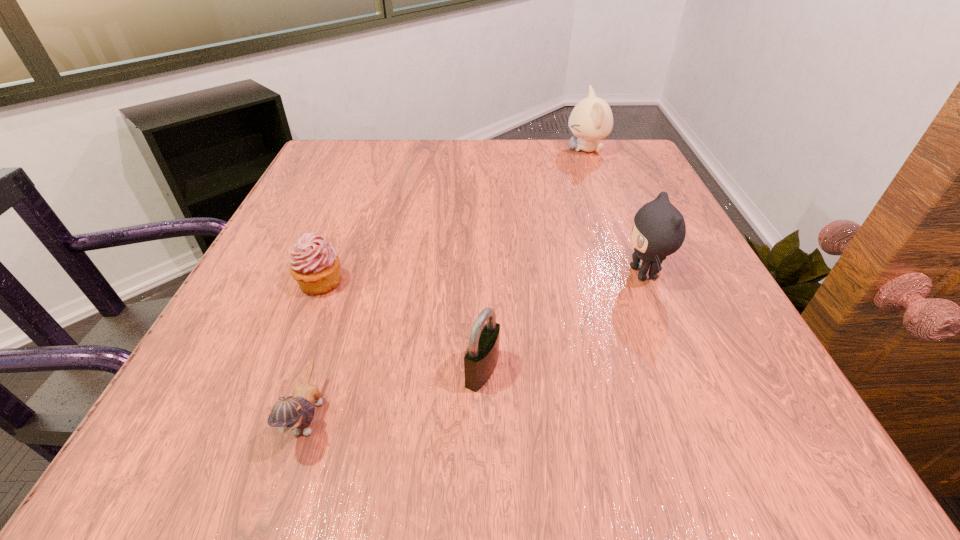
This screenshot has height=540, width=960. Identify the location of free region at the left edge. (285, 319).

Where is `vacant space at the right edge of the desktop`? vacant space at the right edge of the desktop is located at coordinates (689, 248).

Image resolution: width=960 pixels, height=540 pixels. In order to click on free space at the near left corner in this screenshot , I will do `click(190, 448)`.

Where is `vacant space at the far right corner of the desktop`? The image size is (960, 540). vacant space at the far right corner of the desktop is located at coordinates (632, 166).

The height and width of the screenshot is (540, 960). What are the coordinates of `free location at the near right corner of the desktop` in the screenshot? It's located at (705, 426).

Find the location of a particular element. Image resolution: width=960 pixels, height=540 pixels. free space between the leftmost kitten and the third object from right to left is located at coordinates (396, 393).

The width and height of the screenshot is (960, 540). In order to click on vacant point located between the farthest object and the second farthest kitten in this screenshot , I will do `click(615, 211)`.

Where is `blank region between the shortest kitten and the third object from left to right`? This screenshot has width=960, height=540. blank region between the shortest kitten and the third object from left to right is located at coordinates (396, 393).

The height and width of the screenshot is (540, 960). I want to click on unoccupied position between the third object from right to left and the shortest kitten, so click(x=396, y=393).

Locate an element on the screen. vacant space that is in between the farthest object and the second farthest kitten is located at coordinates (615, 211).